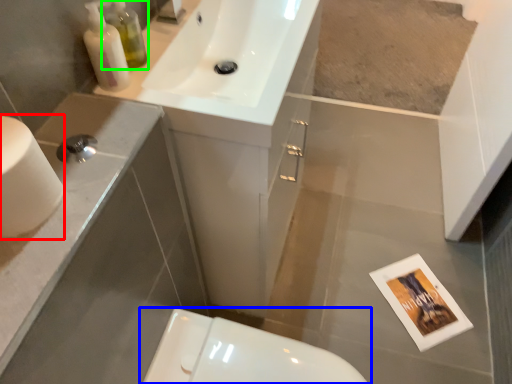
Question: Which object is positioned farthest from toilet paper (highlighted by a red box)? Select from toilet (highlighted by a blue box) and toiletry (highlighted by a green box).

Choices:
 (A) toilet
 (B) toiletry

Answer: (A)